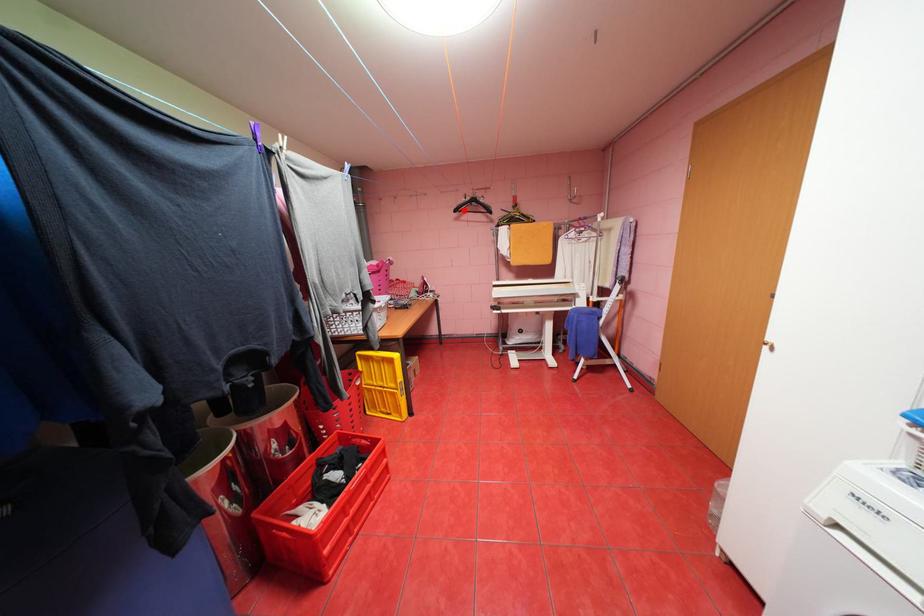
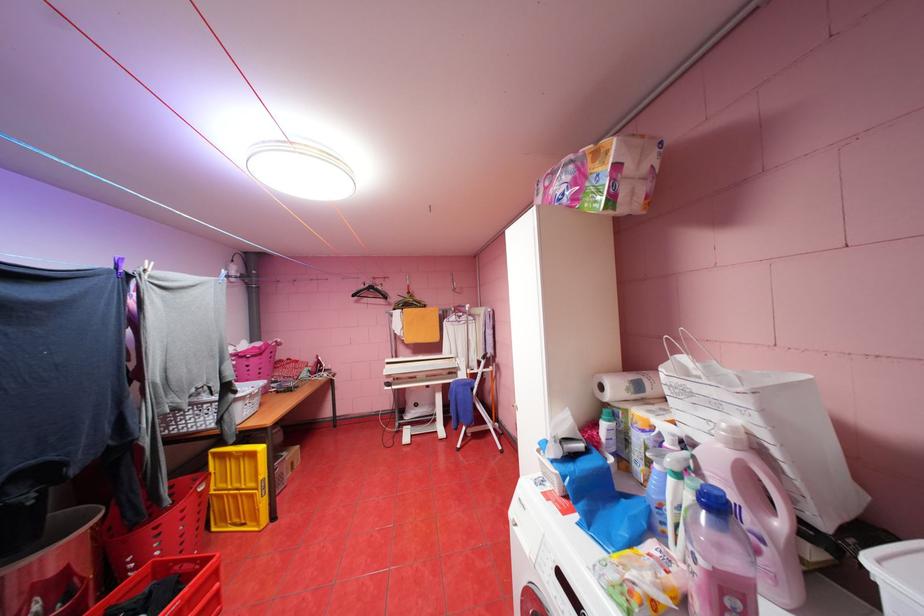
The point at the highlighted location is marked in the first image. Where is the corresponding point in the second image?

(361, 294)